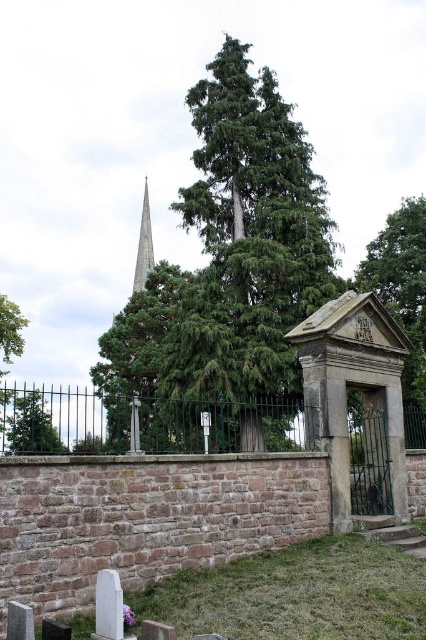
Question: Which of the following is the closest to the observer?

Choices:
 (A) (17, 333)
 (B) (39, 416)
 (C) (167, 429)
 (D) (422, 301)

Answer: (C)

Question: Can you confirm if green wrought iron fence at center is positioned above green leafy tree at left?

Choices:
 (A) no
 (B) yes

Answer: (A)

Question: Which point is farther from the camera taking this photo?

Choices:
 (A) tap(408, 280)
 (B) tap(46, 442)
 (C) tap(17, 342)
 (D) tap(203, 401)

Answer: (C)

Question: Which of the following is the closest to the observer?

Choices:
 (A) green leafy tree at right
 (B) smooth gray spire at center

Answer: (A)

Question: Can you confirm if green coniferous tree at center is wider than green leafy tree at left?

Choices:
 (A) yes
 (B) no

Answer: (B)

Question: Is green leafy tree at right behind green leafy tree at left?

Choices:
 (A) no
 (B) yes

Answer: (A)